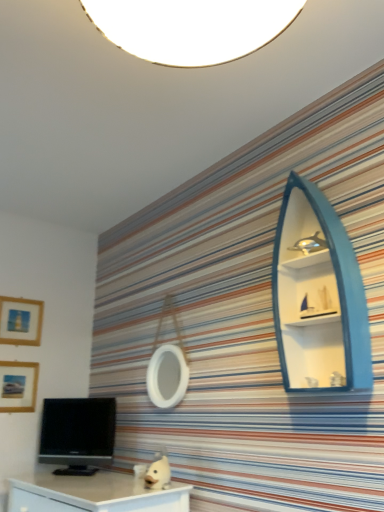
This screenshot has width=384, height=512. What do you see at coordinates (18, 386) in the screenshot?
I see `wooden matte picture frame at lower left, which ranks as the 2th picture frame in top-to-bottom order` at bounding box center [18, 386].

Locate an element on the screen. This screenshot has width=384, height=512. wooden matte picture frame at lower left, which ranks as the 2th picture frame in top-to-bottom order is located at coordinates (18, 386).

The image size is (384, 512). Find the location of `black glossy tv at lower left`. black glossy tv at lower left is located at coordinates (78, 434).

This screenshot has width=384, height=512. Describe the element at coordinates (78, 434) in the screenshot. I see `black glossy tv at lower left` at that location.

Describe the element at coordinates (20, 321) in the screenshot. The height and width of the screenshot is (512, 384). I see `matte gold picture frame at upper left, positioned as the 1th picture frame in top-to-bottom order` at that location.

Where is `teal wood boat-shaped shelf at upper right`? This screenshot has height=512, width=384. teal wood boat-shaped shelf at upper right is located at coordinates (318, 296).

Find the location of a particular element. The width and height of the screenshot is (384, 512). wooden matte picture frame at lower left, the 1th picture frame when ordered from bottom to top is located at coordinates (18, 386).

From a real-world perspective, does matte gold picture frame at upper left, positioned as the 1th picture frame in top-to-bottom order, stand above teal wood boat-shaped shelf at upper right?

Yes, from a real-world perspective, matte gold picture frame at upper left, positioned as the 1th picture frame in top-to-bottom order, is above teal wood boat-shaped shelf at upper right.

Is matte gold picture frame at upper left, the second picture frame from the bottom, taller than teal wood boat-shaped shelf at upper right?

No.

From the image's perspective, is matte gold picture frame at upper left, positioned as the 1th picture frame in top-to-bottom order, beneath teal wood boat-shaped shelf at upper right?

Correct, matte gold picture frame at upper left, positioned as the 1th picture frame in top-to-bottom order, appears lower than teal wood boat-shaped shelf at upper right in the image.

In the scene shown: Considering their positions, is matte gold picture frame at upper left, the second picture frame from the bottom, located in front of or behind teal wood boat-shaped shelf at upper right?

Clearly, matte gold picture frame at upper left, the second picture frame from the bottom, is behind teal wood boat-shaped shelf at upper right.

Can you confirm if teal wood boat-shaped shelf at upper right is taller than matte gold picture frame at upper left, the second picture frame from the bottom?

Indeed, teal wood boat-shaped shelf at upper right has a greater height compared to matte gold picture frame at upper left, the second picture frame from the bottom.

Is teal wood boat-shaped shelf at upper right located outside matte gold picture frame at upper left, the second picture frame from the bottom?

teal wood boat-shaped shelf at upper right lies outside matte gold picture frame at upper left, the second picture frame from the bottom,'s area.

Does teal wood boat-shaped shelf at upper right turn towards matte gold picture frame at upper left, the second picture frame from the bottom?

No, teal wood boat-shaped shelf at upper right is not oriented towards matte gold picture frame at upper left, the second picture frame from the bottom.

Which object is wider, teal wood boat-shaped shelf at upper right or matte gold picture frame at upper left, the second picture frame from the bottom?

Wider between the two is teal wood boat-shaped shelf at upper right.

From the image's perspective, is wooden matte picture frame at lower left, which ranks as the 2th picture frame in top-to-bottom order, above teal wood boat-shaped shelf at upper right?

No, from the image's perspective, wooden matte picture frame at lower left, which ranks as the 2th picture frame in top-to-bottom order, is not over teal wood boat-shaped shelf at upper right.

Starting from the teal wood boat-shaped shelf at upper right, which picture frame is the 1st one behind? Please provide its 2D coordinates.

[(18, 386)]

Does teal wood boat-shaped shelf at upper right turn towards wooden matte picture frame at lower left, the 1th picture frame when ordered from bottom to top?

No, teal wood boat-shaped shelf at upper right is not facing towards wooden matte picture frame at lower left, the 1th picture frame when ordered from bottom to top.

Which object is further away from the camera taking this photo, teal wood boat-shaped shelf at upper right or wooden matte picture frame at lower left, which ranks as the 2th picture frame in top-to-bottom order?

wooden matte picture frame at lower left, which ranks as the 2th picture frame in top-to-bottom order, is behind.

Where is `shelf located above the wooden matte picture frame at lower left, the 1th picture frame when ordered from bottom to top (from a real-world perspective)`? This screenshot has height=512, width=384. shelf located above the wooden matte picture frame at lower left, the 1th picture frame when ordered from bottom to top (from a real-world perspective) is located at coordinates click(x=318, y=296).

Can you confirm if teal wood boat-shaped shelf at upper right is taller than wooden matte picture frame at lower left, the 1th picture frame when ordered from bottom to top?

Indeed, teal wood boat-shaped shelf at upper right has a greater height compared to wooden matte picture frame at lower left, the 1th picture frame when ordered from bottom to top.

Who is bigger, matte gold picture frame at upper left, the second picture frame from the bottom, or wooden matte picture frame at lower left, the 1th picture frame when ordered from bottom to top?

With larger size is matte gold picture frame at upper left, the second picture frame from the bottom.

Considering the relative sizes of matte gold picture frame at upper left, the second picture frame from the bottom, and wooden matte picture frame at lower left, the 1th picture frame when ordered from bottom to top, in the image provided, is matte gold picture frame at upper left, the second picture frame from the bottom, thinner than wooden matte picture frame at lower left, the 1th picture frame when ordered from bottom to top,?

No, matte gold picture frame at upper left, the second picture frame from the bottom, is not thinner than wooden matte picture frame at lower left, the 1th picture frame when ordered from bottom to top.

In the scene shown: Considering the relative sizes of matte gold picture frame at upper left, the second picture frame from the bottom, and wooden matte picture frame at lower left, the 1th picture frame when ordered from bottom to top, in the image provided, is matte gold picture frame at upper left, the second picture frame from the bottom, taller than wooden matte picture frame at lower left, the 1th picture frame when ordered from bottom to top,?

Yes, matte gold picture frame at upper left, the second picture frame from the bottom, is taller than wooden matte picture frame at lower left, the 1th picture frame when ordered from bottom to top.

From a real-world perspective, between matte gold picture frame at upper left, the second picture frame from the bottom, and wooden matte picture frame at lower left, the 1th picture frame when ordered from bottom to top, who is vertically lower?

From a 3D spatial view, wooden matte picture frame at lower left, the 1th picture frame when ordered from bottom to top, is below.

Is wooden matte picture frame at lower left, the 1th picture frame when ordered from bottom to top, facing towards matte gold picture frame at upper left, positioned as the 1th picture frame in top-to-bottom order?

No.

Is wooden matte picture frame at lower left, which ranks as the 2th picture frame in top-to-bottom order, with matte gold picture frame at upper left, positioned as the 1th picture frame in top-to-bottom order?

wooden matte picture frame at lower left, which ranks as the 2th picture frame in top-to-bottom order, and matte gold picture frame at upper left, positioned as the 1th picture frame in top-to-bottom order, are not in contact.

Does wooden matte picture frame at lower left, the 1th picture frame when ordered from bottom to top, have a lesser height compared to matte gold picture frame at upper left, the second picture frame from the bottom?

Yes, wooden matte picture frame at lower left, the 1th picture frame when ordered from bottom to top, is shorter than matte gold picture frame at upper left, the second picture frame from the bottom.

I want to click on picture frame below the matte gold picture frame at upper left, the second picture frame from the bottom (from a real-world perspective), so click(x=18, y=386).

What are the coordinates of `television behind the teal wood boat-shaped shelf at upper right` in the screenshot? It's located at click(78, 434).

Can you see teal wood boat-shaped shelf at upper right touching black glossy tv at lower left?

No, teal wood boat-shaped shelf at upper right is not with black glossy tv at lower left.

From a real-world perspective, is teal wood boat-shaped shelf at upper right physically below black glossy tv at lower left?

No, from a real-world perspective, teal wood boat-shaped shelf at upper right is not below black glossy tv at lower left.

Does teal wood boat-shaped shelf at upper right have a greater width compared to black glossy tv at lower left?

Yes, teal wood boat-shaped shelf at upper right is wider than black glossy tv at lower left.

The image size is (384, 512). What are the coordinates of `the 1st picture frame positioned below the teal wood boat-shaped shelf at upper right (from the image's perspective)` in the screenshot? It's located at (20, 321).

You are a GUI agent. You are given a task and a screenshot of the screen. Output one action in this format:
    pyautogui.click(x=<x>, y=<y>)
    Task: Click on the shelf above the matte gold picture frame at upper left, the second picture frame from the bottom (from the image's perspective)
    The image size is (384, 512).
    Given the screenshot: What is the action you would take?
    pyautogui.click(x=318, y=296)

From the image, which object appears to be nearer to wooden matte picture frame at lower left, the 1th picture frame when ordered from bottom to top, teal wood boat-shaped shelf at upper right or matte gold picture frame at upper left, positioned as the 1th picture frame in top-to-bottom order?

matte gold picture frame at upper left, positioned as the 1th picture frame in top-to-bottom order, lies closer to wooden matte picture frame at lower left, the 1th picture frame when ordered from bottom to top, than the other object.

Which object lies further to the anchor point matte gold picture frame at upper left, positioned as the 1th picture frame in top-to-bottom order, wooden matte picture frame at lower left, which ranks as the 2th picture frame in top-to-bottom order, or black glossy tv at lower left?

black glossy tv at lower left is further to matte gold picture frame at upper left, positioned as the 1th picture frame in top-to-bottom order.

From the image, which object appears to be nearer to wooden matte picture frame at lower left, which ranks as the 2th picture frame in top-to-bottom order, teal wood boat-shaped shelf at upper right or black glossy tv at lower left?

black glossy tv at lower left is positioned closer to the anchor wooden matte picture frame at lower left, which ranks as the 2th picture frame in top-to-bottom order.

Considering their positions, is matte gold picture frame at upper left, the second picture frame from the bottom, positioned further to black glossy tv at lower left than teal wood boat-shaped shelf at upper right?

teal wood boat-shaped shelf at upper right lies further to black glossy tv at lower left than the other object.

Considering their positions, is black glossy tv at lower left positioned further to teal wood boat-shaped shelf at upper right than matte gold picture frame at upper left, positioned as the 1th picture frame in top-to-bottom order?

The object further to teal wood boat-shaped shelf at upper right is matte gold picture frame at upper left, positioned as the 1th picture frame in top-to-bottom order.

When comparing their distances from black glossy tv at lower left, does teal wood boat-shaped shelf at upper right or matte gold picture frame at upper left, the second picture frame from the bottom, seem further?

Based on the image, teal wood boat-shaped shelf at upper right appears to be further to black glossy tv at lower left.

When comparing their distances from matte gold picture frame at upper left, positioned as the 1th picture frame in top-to-bottom order, does black glossy tv at lower left or teal wood boat-shaped shelf at upper right seem closer?

black glossy tv at lower left is closer to matte gold picture frame at upper left, positioned as the 1th picture frame in top-to-bottom order.

When comparing their distances from black glossy tv at lower left, does wooden matte picture frame at lower left, which ranks as the 2th picture frame in top-to-bottom order, or teal wood boat-shaped shelf at upper right seem closer?

wooden matte picture frame at lower left, which ranks as the 2th picture frame in top-to-bottom order, is closer to black glossy tv at lower left.

Locate an element on the screen. This screenshot has width=384, height=512. picture frame between matte gold picture frame at upper left, positioned as the 1th picture frame in top-to-bottom order, and teal wood boat-shaped shelf at upper right is located at coordinates (18, 386).

Locate an element on the screen. picture frame between matte gold picture frame at upper left, the second picture frame from the bottom, and black glossy tv at lower left from top to bottom is located at coordinates (x=18, y=386).

Identify the location of television between wooden matte picture frame at lower left, which ranks as the 2th picture frame in top-to-bottom order, and teal wood boat-shaped shelf at upper right, in the horizontal direction. (78, 434).

Where is `television located between matte gold picture frame at upper left, the second picture frame from the bottom, and teal wood boat-shaped shelf at upper right in the left-right direction`? This screenshot has height=512, width=384. television located between matte gold picture frame at upper left, the second picture frame from the bottom, and teal wood boat-shaped shelf at upper right in the left-right direction is located at coordinates (78, 434).